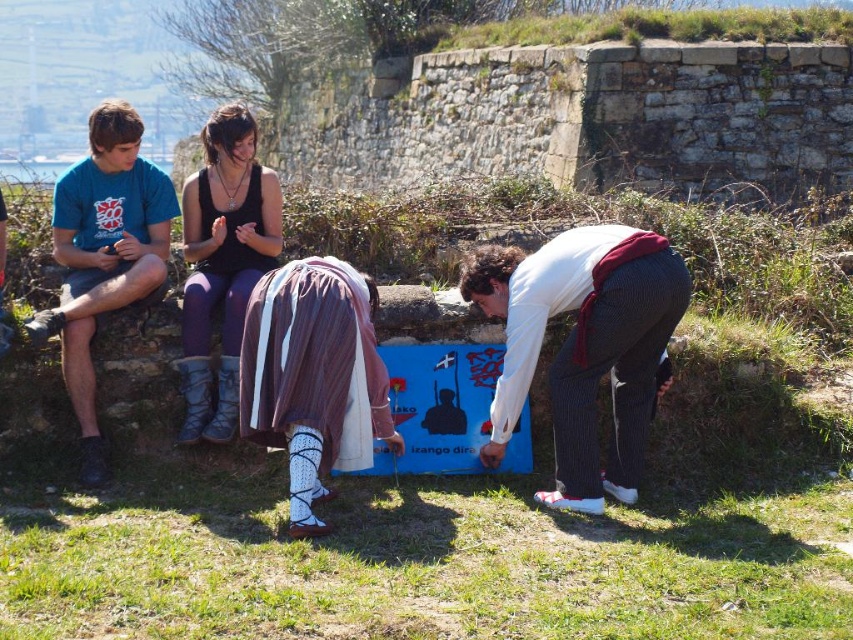
Question: Which point is closer to the camera taking this photo?

Choices:
 (A) (639, 412)
 (B) (189, 192)

Answer: (A)

Question: Is brown woven skirt at center wider than blue cotton t-shirt at left?

Choices:
 (A) yes
 (B) no

Answer: (B)

Question: Does blue cotton t-shirt at left have a lesser width compared to matte black tank top at center?

Choices:
 (A) yes
 (B) no

Answer: (B)

Question: Which point appears farthest from the camera in this image?

Choices:
 (A) (234, 216)
 (B) (102, 147)

Answer: (A)

Question: Considering the real-world distances, which object is closest to the blue cotton t-shirt at left?

Choices:
 (A) brown woven skirt at center
 (B) white striped pants at lower center
 (C) matte black tank top at center

Answer: (C)

Question: Is white striped pants at lower center to the left of matte black tank top at center from the viewer's perspective?

Choices:
 (A) no
 (B) yes

Answer: (A)